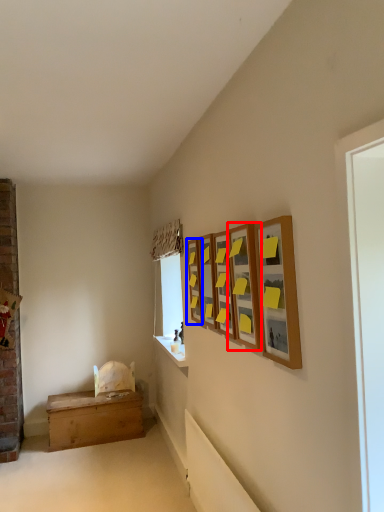
Question: Which of the following is the closest to the observer, picture frame (highlighted by a red box) or picture frame (highlighted by a blue box)?

Choices:
 (A) picture frame
 (B) picture frame

Answer: (A)